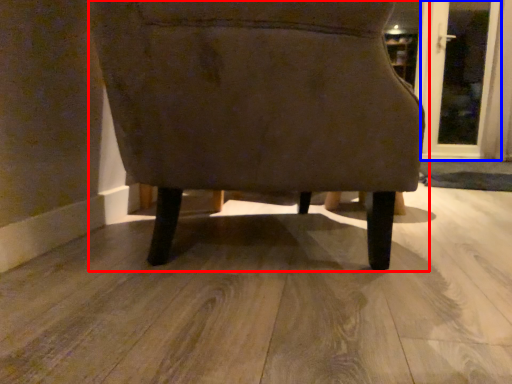
Question: Which object is further to the camera taking this photo, chair (highlighted by a red box) or screen door (highlighted by a blue box)?

Choices:
 (A) chair
 (B) screen door

Answer: (B)